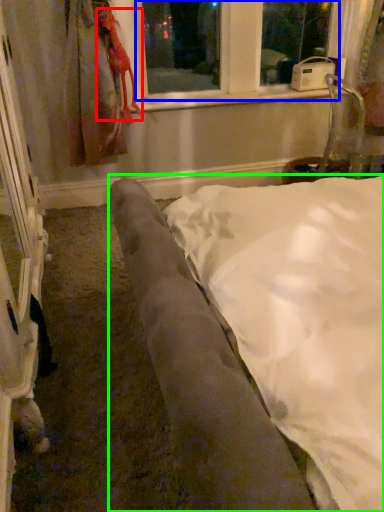
Question: Which object is the farthest from animal (highlighted by a red box)? Choose among these: bay window (highlighted by a blue box) or furniture (highlighted by a green box).

Choices:
 (A) bay window
 (B) furniture

Answer: (B)